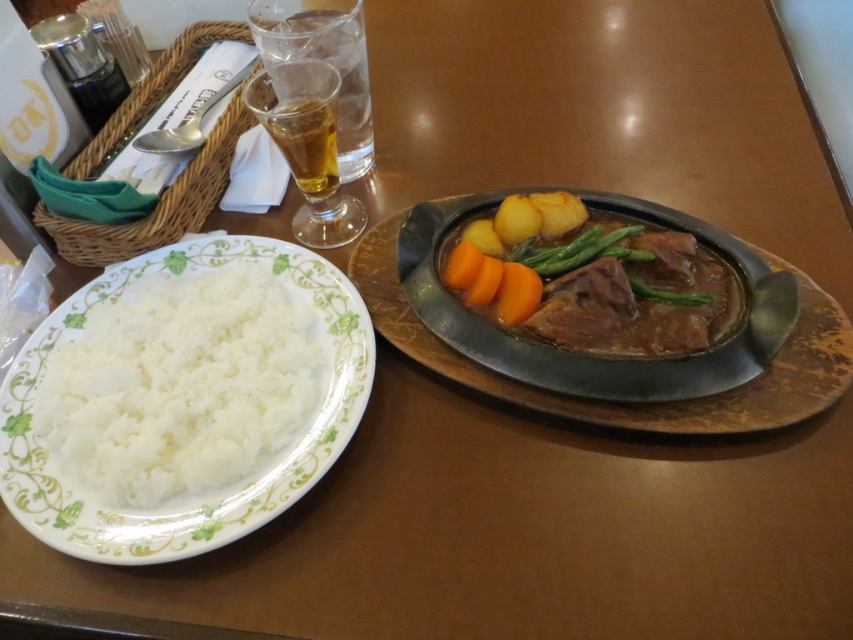
You are a bartender trying to place the translucent glass beer at upper center and the green smooth beans at center on a narrow shelf. Which object should you place first to ensure both fit side by side without overlapping?

The translucent glass beer at upper center has a lesser width compared to the green smooth beans at center. Therefore, place the translucent glass beer at upper center first, then the green smooth beans at center to ensure they fit side by side without overlapping.

You are a chef inspecting the layout of this meal. There is a point marked at coordinates [628,288] in the image. What object is located at this point?

The point at coordinates [628,288] marks the brown glossy stew at center.

You are a guest at a dinner table and want to reach for the white matte rice at left and the brown glossy stew at center. Based on their positions, which one is closer to your hand if you are sitting directly in front of the table?

The white matte rice at left is closer to your hand because it is located below the brown glossy stew at center, meaning it is positioned lower on the table and nearer to you.